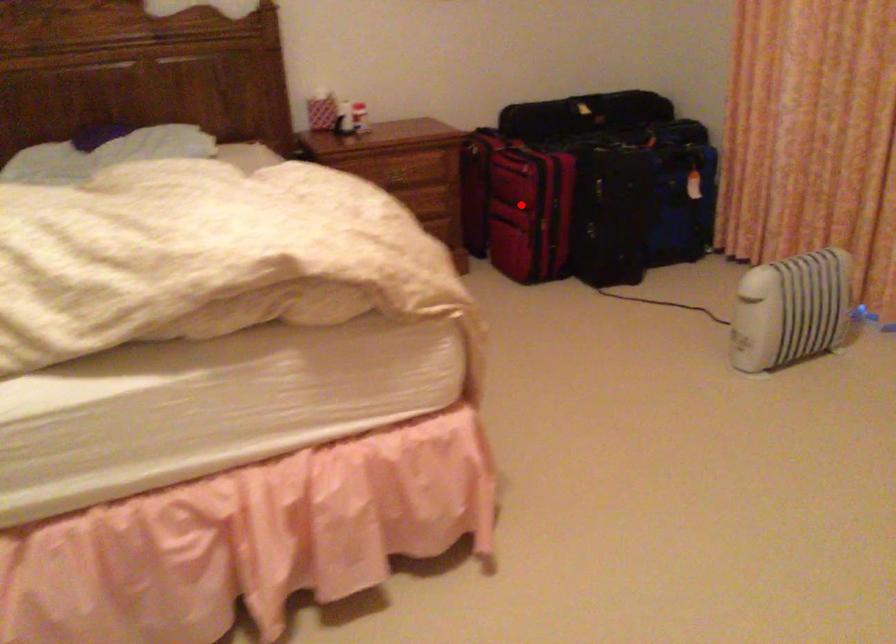
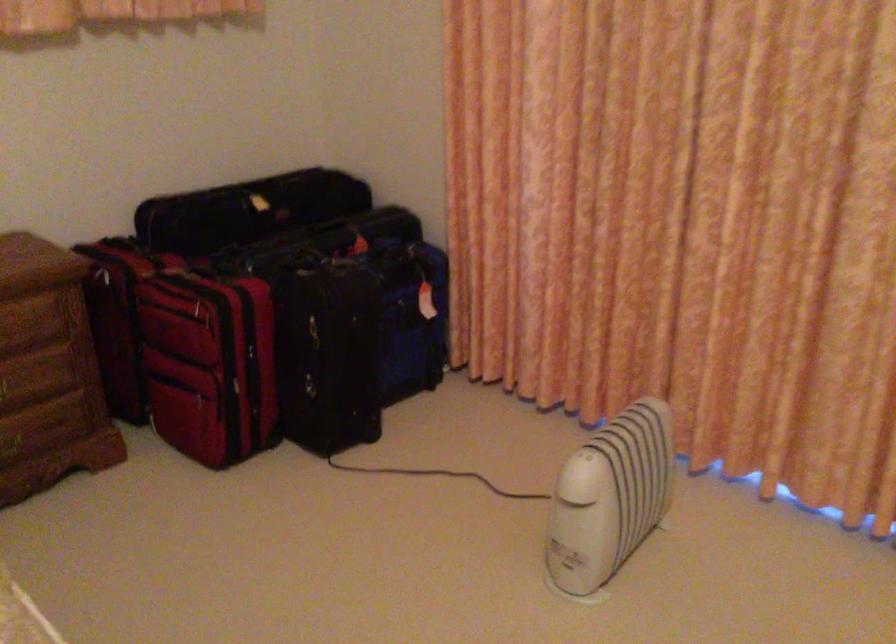
Question: I am providing you with two images of the same scene from different viewpoints. Image1 has a red point marked. In image2, the corresponding 3D location appears at what relative position? Reply with the corresponding letter.

Choices:
 (A) Closer
 (B) Farther

Answer: (A)